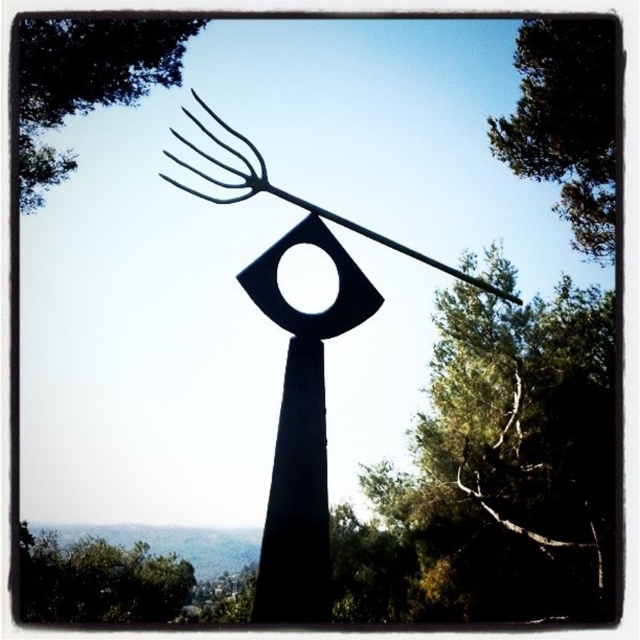
You are a bird flying between the two green leafy trees. The distance between them is crucial for your flight path. Can you safely fly between the green leafy tree at upper right and the green leafy tree at upper left without needing to adjust your altitude?

The green leafy tree at upper right is 13.37 meters away from the green leafy tree at upper left. Since this distance allows enough space for a bird to fly between them at a consistent altitude, you can safely fly without needing to adjust your altitude.

You are standing in front of the sculpture and want to take a photo that includes both the green leafy tree at upper right and the green leafy tree at lower left. Which tree should you position closer to the top of your camera frame?

The green leafy tree at upper right should be positioned closer to the top of the camera frame because it is located above the green leafy tree at lower left.